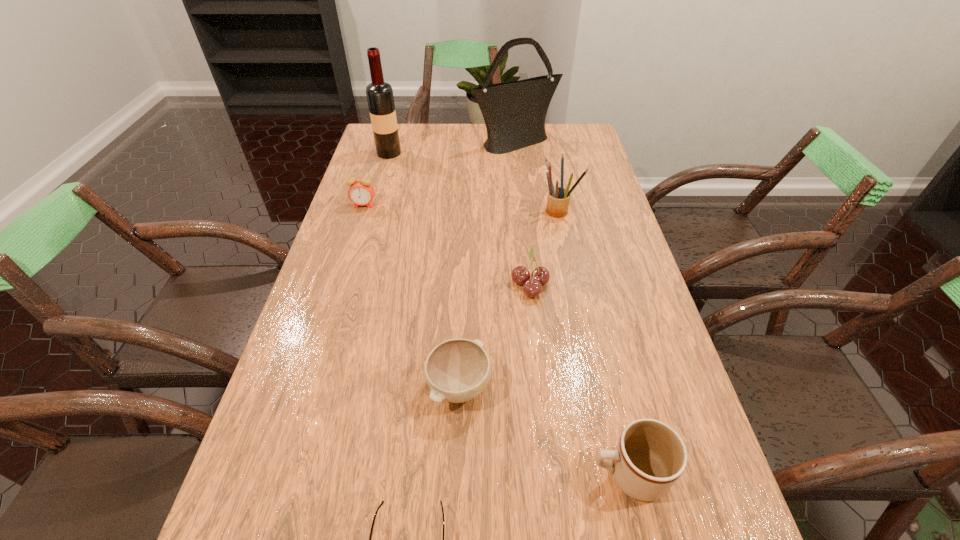
Where is `shoulder bag`? shoulder bag is located at coordinates (514, 112).

This screenshot has width=960, height=540. What are the coordinates of `wine bottle` in the screenshot? It's located at (380, 98).

In order to click on the third tallest object in this screenshot , I will do `click(558, 199)`.

The width and height of the screenshot is (960, 540). I want to click on alarm clock, so 361,192.

The image size is (960, 540). I want to click on mug, so click(650, 456).

Locate an element on the screen. The image size is (960, 540). the fourth nearest object is located at coordinates (540, 276).

Where is `the sixth farthest object`? the sixth farthest object is located at coordinates (457, 370).

This screenshot has height=540, width=960. What are the coordinates of `the second shortest object` in the screenshot? It's located at (457, 370).

This screenshot has width=960, height=540. In order to click on vacant space located on the front of the shoulder bag in this screenshot , I will do `click(518, 174)`.

The width and height of the screenshot is (960, 540). In order to click on free space located 0.240m on the front of the wine bottle in this screenshot , I will do [375, 199].